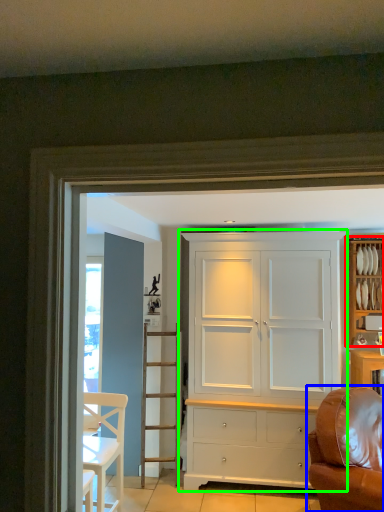
Question: Based on their relative distances, which object is farther from cabinetry (highlighted by a red box)? Choose from studio couch (highlighted by a blue box) and cupboard (highlighted by a green box).

Choices:
 (A) studio couch
 (B) cupboard

Answer: (A)